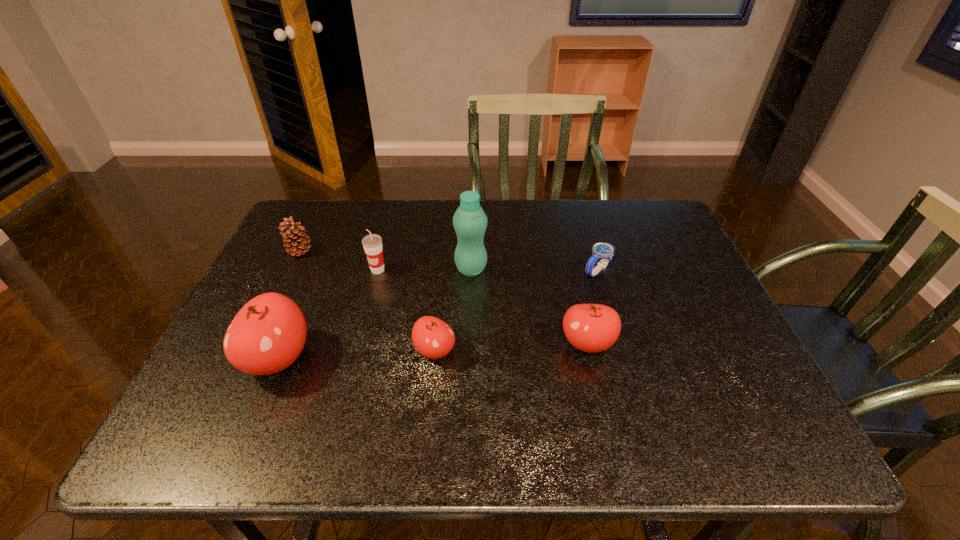
You are a GUI agent. You are given a task and a screenshot of the screen. Output one action in this format:
    pyautogui.click(x=<x>, y=<y>)
    Task: Click on the free location that satisfies the following two spatial constraints: 1. on the side of the third object from left to right with the logo; 2. on the left side of the sixth tallest object
    The height and width of the screenshot is (540, 960).
    Given the screenshot: What is the action you would take?
    pyautogui.click(x=356, y=350)

What are the coordinates of `blank area in the image that satisfies the following two spatial constraints: 1. on the side of the watch with the logo; 2. on the left side of the cup` in the screenshot? It's located at (377, 270).